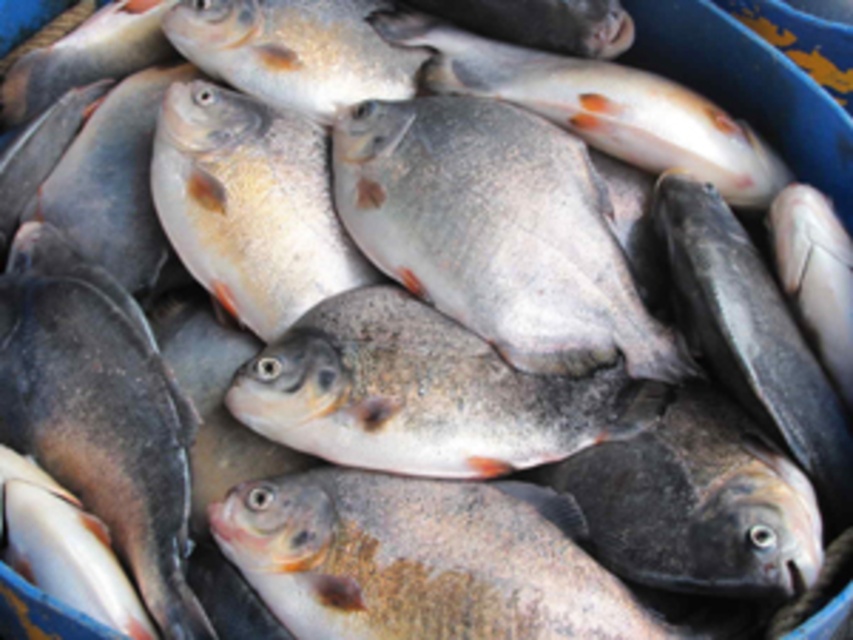
You are a chef preparing a seafood platter and need to arrange the fish from the image. You want to place the gray matte fish at center in front of the shiny silver fish at center. Is this possible given their current positions?

The gray matte fish at center is currently behind the shiny silver fish at center, so moving it to the front would require rearranging them.

You are a fishmonger arranging fish in a container. You have a shiny silver fish at center and a gray matte fish at center. Which fish should you place in a taller section of the container to accommodate its height?

The shiny silver fish at center is taller than the gray matte fish at center, so you should place the shiny silver fish at center in the taller section of the container to accommodate its height.